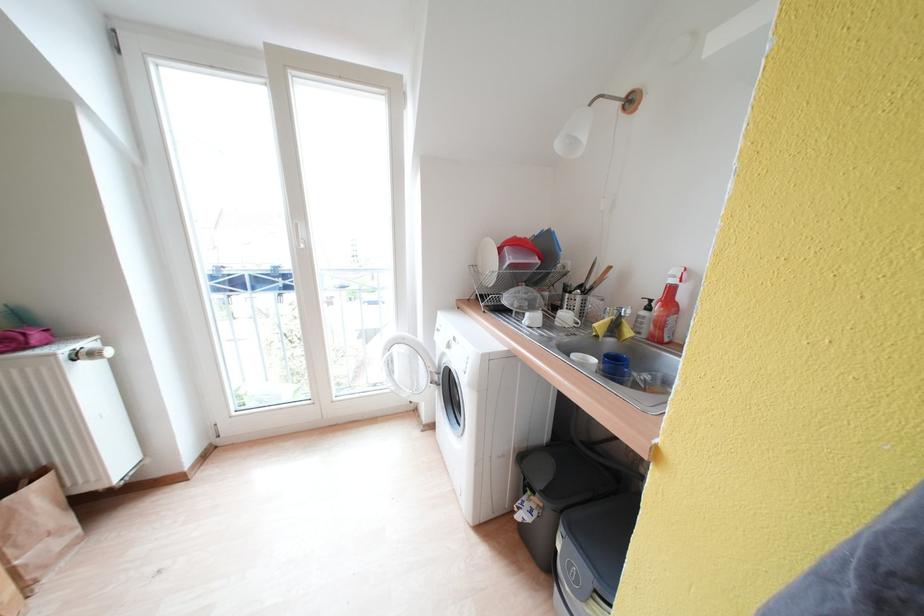
Find the location of a particular element. The width and height of the screenshot is (924, 616). red bottle trigger is located at coordinates (684, 315).